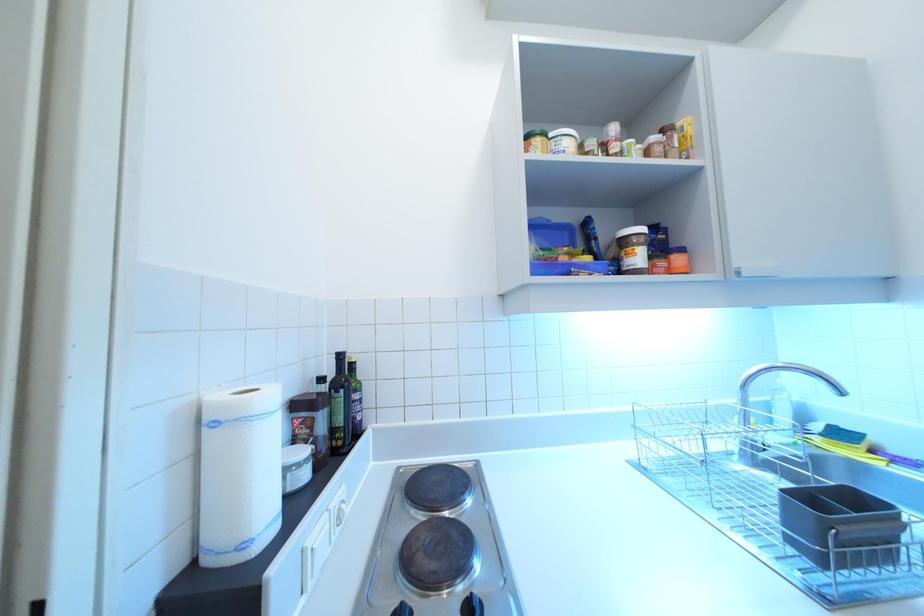
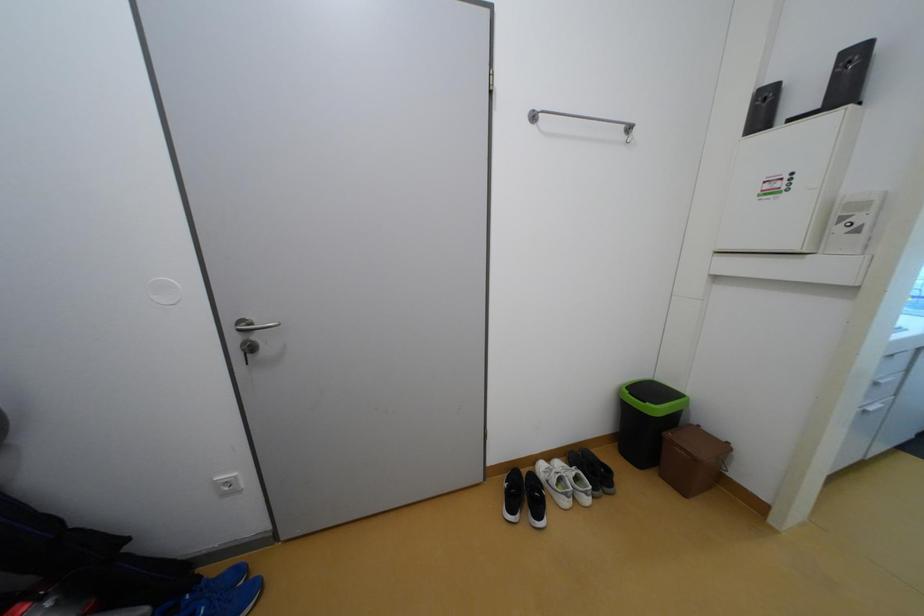
Question: Which direction would the cameraman need to move to produce the second image? Reply with the corresponding letter.

Choices:
 (A) Left
 (B) Right
 (C) Forward
 (D) Backward

Answer: (A)